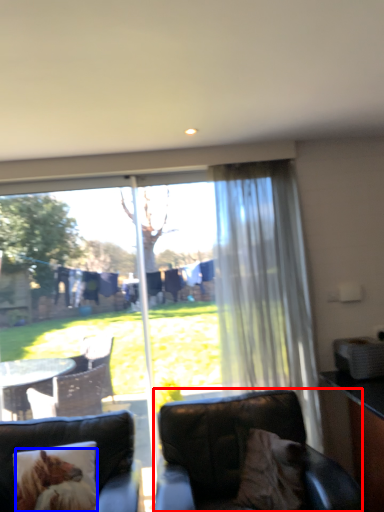
Question: Which point is further to the camera, chair (highlighted by a red box) or animal (highlighted by a blue box)?

Choices:
 (A) chair
 (B) animal

Answer: (B)